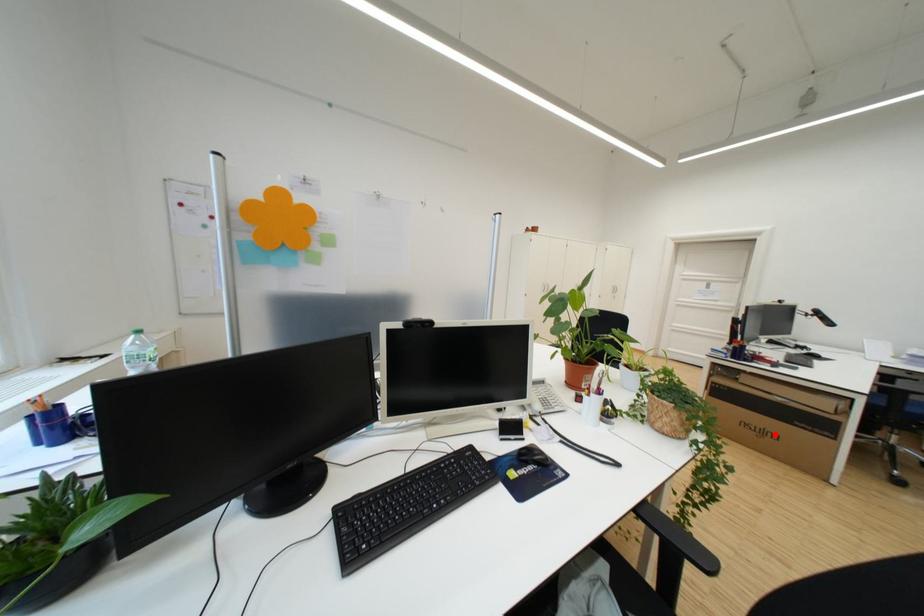
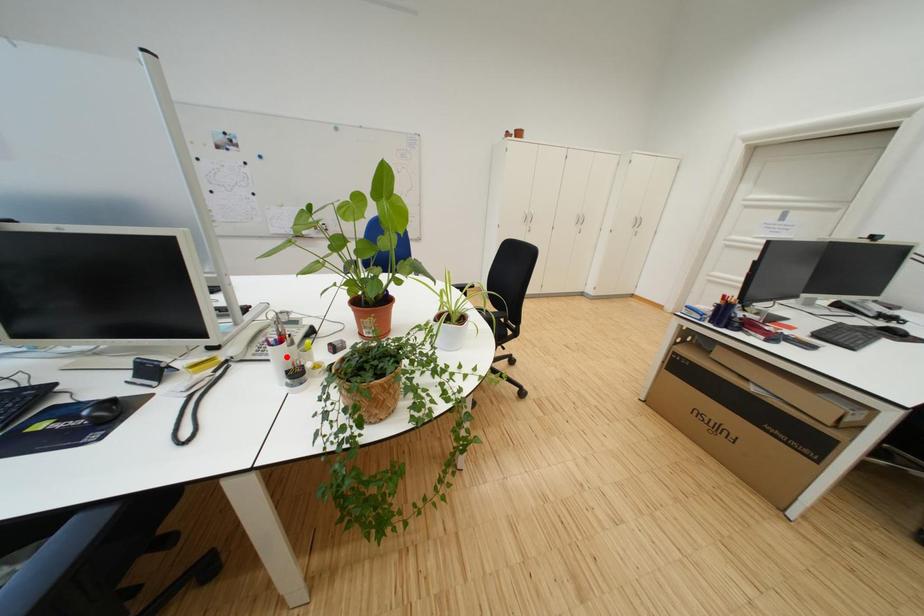
I am providing you with two images of the same scene from different viewpoints. A red point is marked on the first image and another point is marked on the second image. Does the point marked in image1 correspond to the same location as the one in image2?

No